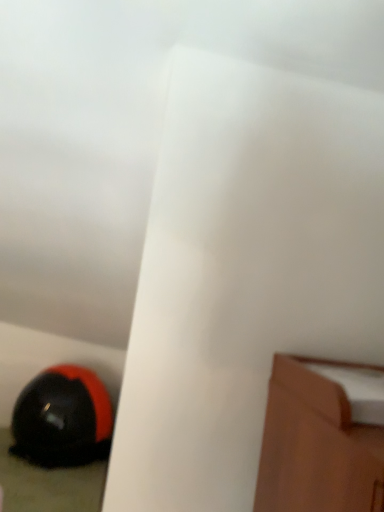
Question: Should I look upward or downward to see black matte helmet at lower left?

Choices:
 (A) up
 (B) down

Answer: (B)